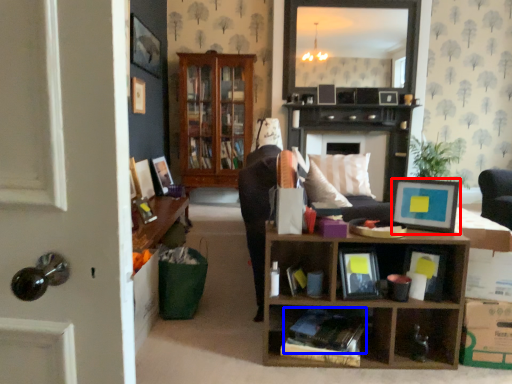
Question: Which of the following is the farthest to the observer, picture frame (highlighted by a red box) or book (highlighted by a blue box)?

Choices:
 (A) picture frame
 (B) book

Answer: (A)